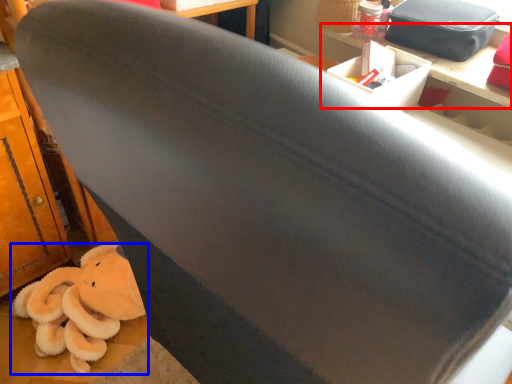
Question: Which object is closer to the camera taking this photo, table (highlighted by a red box) or toy (highlighted by a blue box)?

Choices:
 (A) table
 (B) toy

Answer: (A)